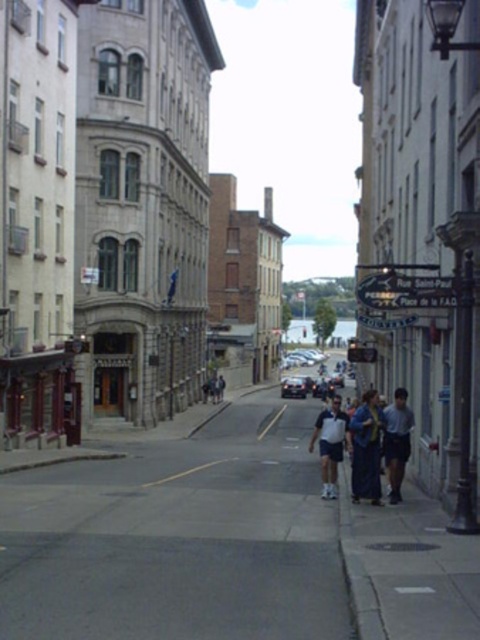
Question: Considering the relative positions of light blue denim shorts at lower right and shiny silver car at center in the image provided, where is light blue denim shorts at lower right located with respect to shiny silver car at center?

Choices:
 (A) right
 (B) left

Answer: (B)

Question: From the image, what is the correct spatial relationship of blue fabric coat at center in relation to white cotton shirt at center?

Choices:
 (A) below
 (B) above

Answer: (B)

Question: Estimate the real-world distances between objects in this image. Which object is closer to the gray concrete sidewalk at center?

Choices:
 (A) light blue denim shorts at lower right
 (B) white cotton shirt at center
 (C) blue fabric coat at center

Answer: (B)

Question: Which of these objects is positioned farthest from the light blue denim shorts at lower right?

Choices:
 (A) white cotton shirt at center
 (B) gray concrete sidewalk at center
 (C) shiny silver car at center

Answer: (C)

Question: Which point appears farthest from the camera in this image?

Choices:
 (A) (331, 564)
 (B) (300, 380)

Answer: (B)

Question: Can you confirm if white cotton shirt at center is smaller than shiny silver car at center?

Choices:
 (A) no
 (B) yes

Answer: (A)